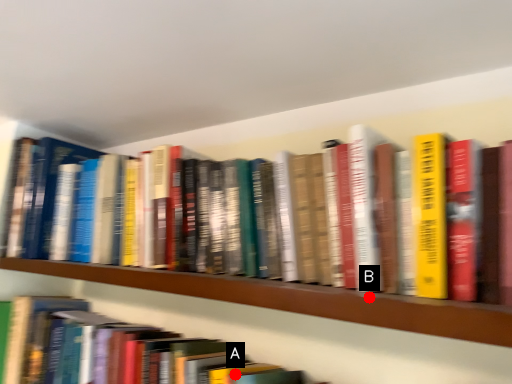
Question: Two points are circled on the image, labeled by A and B beside each circle. Which point is farther from the camera taking this photo?

Choices:
 (A) A is further
 (B) B is further

Answer: (A)